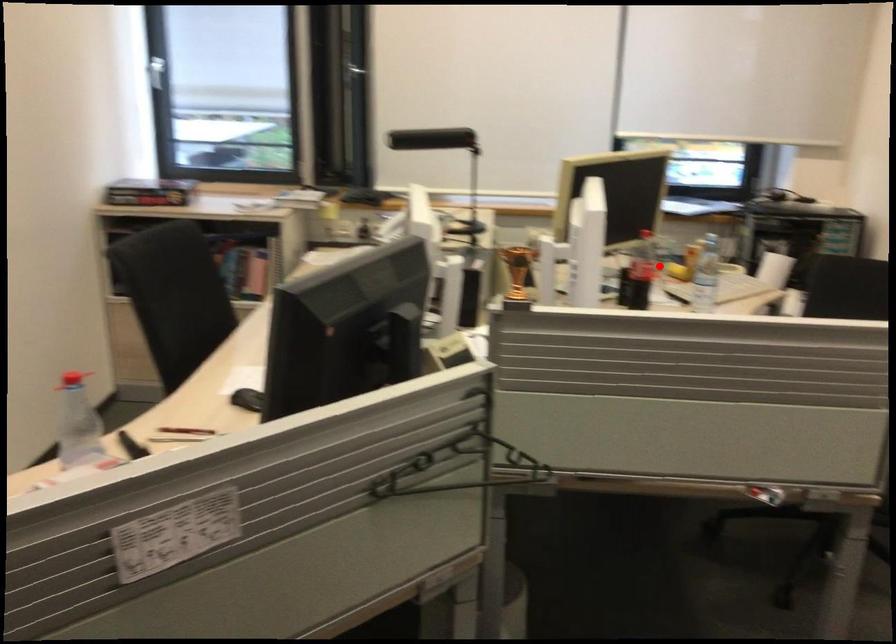
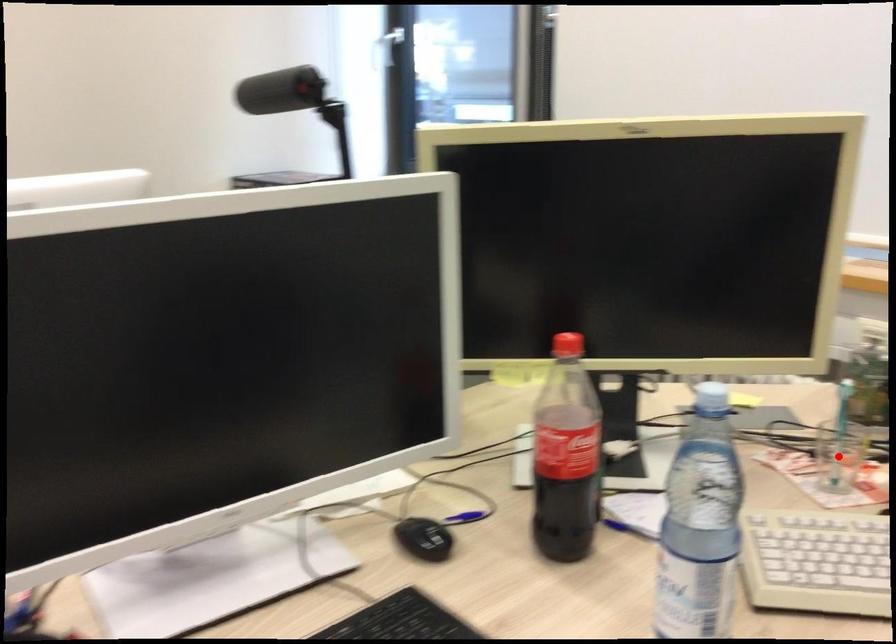
Looking at this image, I am providing you with two images of the same scene from different viewpoints. A red point is marked on the first image and another point is marked on the second image. Is the marked point in image1 the same physical position as the marked point in image2?

Yes